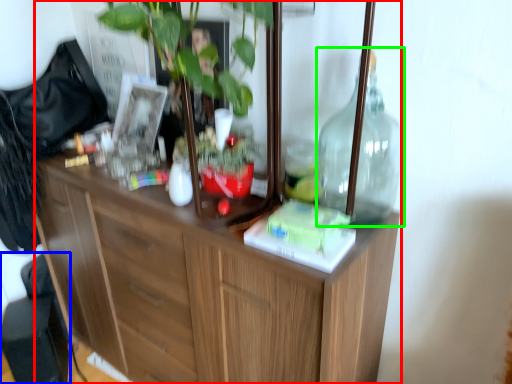
Question: Estimate the real-world distances between objects in this image. Which object is closer to cabinetry (highlighted by a red box), swivel chair (highlighted by a blue box) or bottle (highlighted by a green box)?

Choices:
 (A) swivel chair
 (B) bottle

Answer: (B)